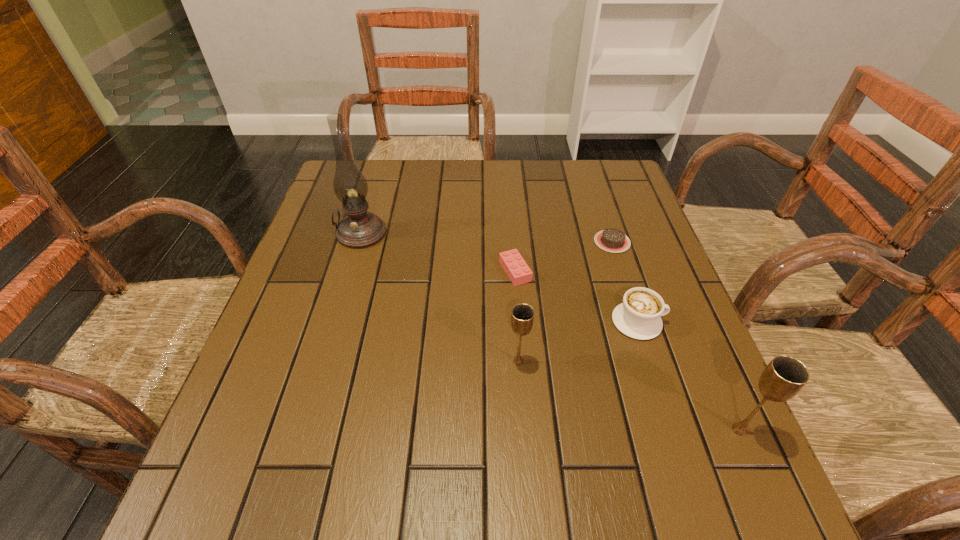
Identify the location of cappuccino at the right edge. This screenshot has width=960, height=540. (638, 316).

The height and width of the screenshot is (540, 960). Find the location of `object present at the near right corner`. object present at the near right corner is located at coordinates (784, 376).

I want to click on free space at the far edge of the desktop, so click(501, 164).

The width and height of the screenshot is (960, 540). In the image, there is a desktop. In order to click on vacant space at the near edge in this screenshot , I will do `click(417, 415)`.

You are a GUI agent. You are given a task and a screenshot of the screen. Output one action in this format:
    pyautogui.click(x=<x>, y=<y>)
    Task: Click on the vacant space at the left edge of the desktop
    
    Given the screenshot: What is the action you would take?
    pyautogui.click(x=325, y=253)

The width and height of the screenshot is (960, 540). I want to click on vacant space at the right edge of the desktop, so click(x=656, y=349).

In the image, there is a desktop. At what (x,y) coordinates should I click in order to perform the action: click on vacant space at the far right corner. Please return your answer as a coordinate pair (x, y). This screenshot has height=540, width=960. Looking at the image, I should click on (579, 176).

Locate an element on the screen. This screenshot has width=960, height=540. vacant space that is in between the second nearest object and the chocolate cake is located at coordinates (565, 302).

This screenshot has width=960, height=540. What are the coordinates of `free space between the third shortest object and the rightmost object` in the screenshot? It's located at (688, 376).

The height and width of the screenshot is (540, 960). Identify the location of vacant region between the right chalice and the chocolate cake. (676, 336).